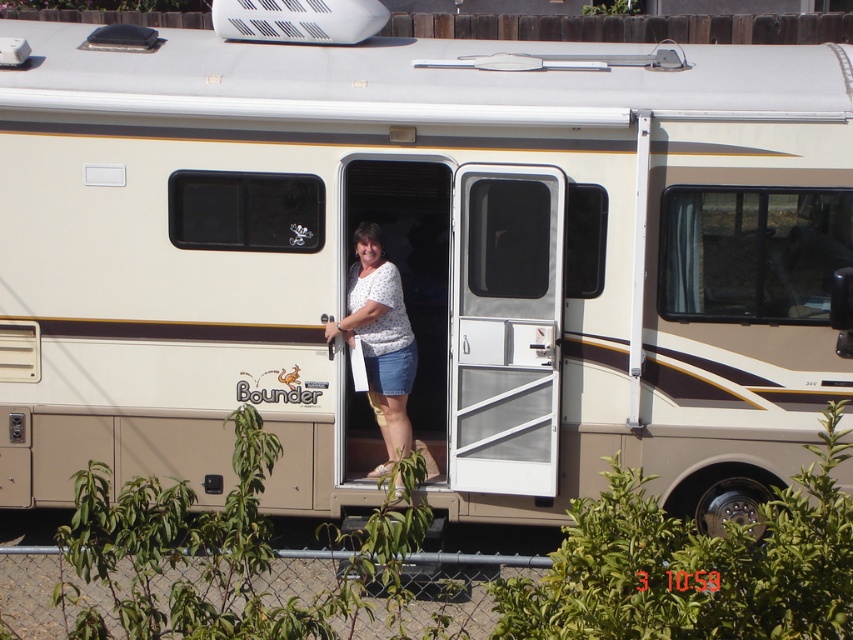
Between white plastic door at center and white dotted shirt at center, which one is positioned higher?

white plastic door at center is above.

Is white plastic door at center wider than white dotted shirt at center?

Indeed, white plastic door at center has a greater width compared to white dotted shirt at center.

Between point (451, 349) and point (364, 264), which one is positioned behind?

Point (364, 264)

This screenshot has width=853, height=640. Find the location of `white plastic door at center`. white plastic door at center is located at coordinates click(505, 330).